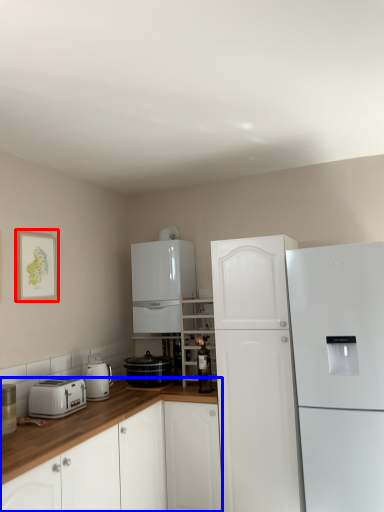
Question: Which object is closer to the camera taking this photo, picture frame (highlighted by a red box) or cabinetry (highlighted by a blue box)?

Choices:
 (A) picture frame
 (B) cabinetry

Answer: (B)